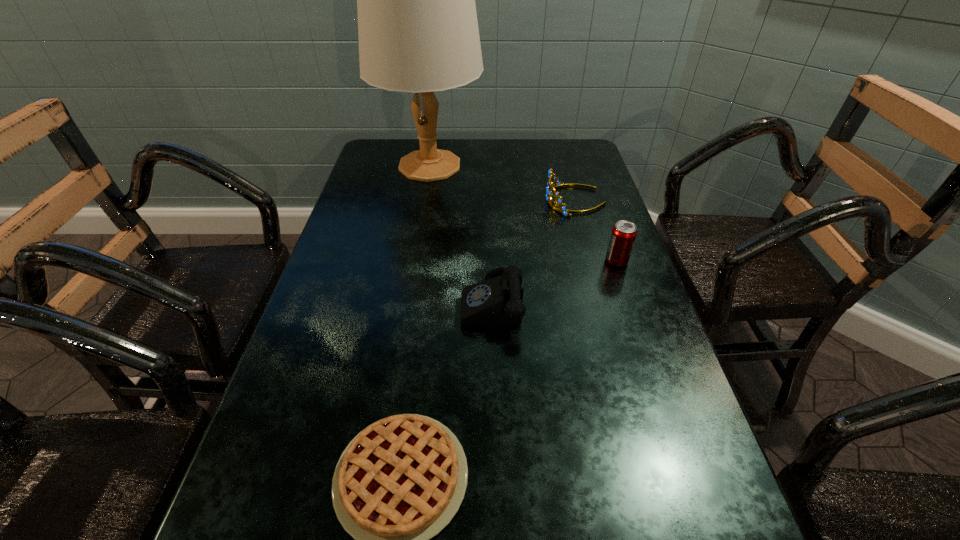
Image resolution: width=960 pixels, height=540 pixels. I want to click on vacant space located on the dial of the second nearest object, so click(317, 301).

The image size is (960, 540). Find the location of `free space located on the dial of the second nearest object`. free space located on the dial of the second nearest object is located at coordinates (420, 301).

I want to click on object positioned at the far edge, so click(x=418, y=32).

Locate an element on the screen. The image size is (960, 540). object that is at the left edge is located at coordinates (418, 32).

Where is `soda can positioned at the right edge`? The image size is (960, 540). soda can positioned at the right edge is located at coordinates (623, 235).

Image resolution: width=960 pixels, height=540 pixels. Find the location of `tiara that is at the right edge`. tiara that is at the right edge is located at coordinates (562, 209).

This screenshot has height=540, width=960. I want to click on object present at the far left corner, so click(418, 32).

Locate an element on the screen. This screenshot has height=540, width=960. vacant region at the far edge is located at coordinates (457, 148).

Image resolution: width=960 pixels, height=540 pixels. I want to click on free space at the left edge of the desktop, so click(373, 189).

Find the location of `free spot at the right edge of the desktop`. free spot at the right edge of the desktop is located at coordinates (644, 298).